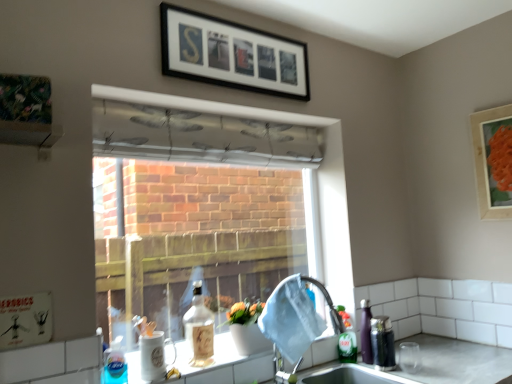
Describe the element at coordinates (155, 356) in the screenshot. I see `white ceramic mug at lower center, the 2th beverage from the right` at that location.

The width and height of the screenshot is (512, 384). What do you see at coordinates (115, 364) in the screenshot? I see `translucent plastic bottle at lower left, acting as the first bottle starting from the left` at bounding box center [115, 364].

Find the location of a particular element. The width and height of the screenshot is (512, 384). translucent plastic bottle at lower left, acting as the first bottle starting from the left is located at coordinates (115, 364).

Find the location of a particular element. black matte picture frame at upper center, which ranks as the first picture frame in left-to-right order is located at coordinates (231, 54).

Find the location of a particular element. The width and height of the screenshot is (512, 384). white ceramic mug at lower center, which is the 1th beverage in front-to-back order is located at coordinates (155, 356).

Relative to white ceramic mug at lower center, the first beverage in the left-to-right sequence, is translucent plastic bottle at lower right, the first beverage when ordered from back to front, in front or behind?

In the image, translucent plastic bottle at lower right, the first beverage when ordered from back to front, appears behind white ceramic mug at lower center, the first beverage in the left-to-right sequence.

Is translucent plastic bottle at lower right, placed as the first beverage when sorted from right to left, oriented away from white ceramic mug at lower center, the 2th beverage from the right?

No, translucent plastic bottle at lower right, placed as the first beverage when sorted from right to left, is not facing away from white ceramic mug at lower center, the 2th beverage from the right.

From a real-world perspective, is translucent plastic bottle at lower right, marked as the 2th beverage in a left-to-right arrangement, beneath white ceramic mug at lower center, the first beverage in the left-to-right sequence?

Yes, from a real-world perspective, translucent plastic bottle at lower right, marked as the 2th beverage in a left-to-right arrangement, is below white ceramic mug at lower center, the first beverage in the left-to-right sequence.

Which is in front, point (373, 347) or point (160, 355)?

The point (160, 355) is in front.

Is transparent fabric at center beside white ceramic mug at lower center?

No, transparent fabric at center is not making contact with white ceramic mug at lower center.

Could you tell me if transparent fabric at center is facing white ceramic mug at lower center?

Yes, transparent fabric at center is turned towards white ceramic mug at lower center.

Where is `counter top in front of the transparent fabric at center`? The height and width of the screenshot is (384, 512). counter top in front of the transparent fabric at center is located at coordinates (458, 361).

Is transparent fabric at center to the left of white ceramic mug at lower center from the viewer's perspective?

Yes.

Can you confirm if transparent fabric at center is bigger than black matte picture frame at upper center, which ranks as the first picture frame in left-to-right order?

Yes, transparent fabric at center is bigger than black matte picture frame at upper center, which ranks as the first picture frame in left-to-right order.

From the image's perspective, between transparent fabric at center and black matte picture frame at upper center, positioned as the 1th picture frame in top-to-bottom order, who is located below?

From the image's view, transparent fabric at center is below.

Which is behind, point (331, 245) or point (221, 21)?

Positioned behind is point (331, 245).

Which of these two, transparent fabric at center or black matte picture frame at upper center, positioned as the 1th picture frame in top-to-bottom order, is thinner?

With smaller width is black matte picture frame at upper center, positioned as the 1th picture frame in top-to-bottom order.

Based on the photo, who is more distant, translucent plastic bottle at lower left, the third bottle in the back-to-front sequence, or satin nickel faucet at sink right?

Positioned behind is satin nickel faucet at sink right.

Between translucent plastic bottle at lower left, placed as the first bottle when sorted from front to back, and satin nickel faucet at sink right, which one appears on the right side from the viewer's perspective?

satin nickel faucet at sink right.

Between translucent plastic bottle at lower left, which ranks as the third bottle in right-to-left order, and satin nickel faucet at sink right, which one has less height?

translucent plastic bottle at lower left, which ranks as the third bottle in right-to-left order.

Image resolution: width=512 pixels, height=384 pixels. I want to click on faucet on the right side of translucent plastic bottle at lower left, the third bottle in the back-to-front sequence, so click(x=294, y=322).

Which of these two, translucent glass bottle at lower center, the second bottle in the front-to-back sequence, or matte wooden picture frame at upper right, which is counted as the first picture frame, starting from the bottom, stands taller?

Standing taller between the two is matte wooden picture frame at upper right, which is counted as the first picture frame, starting from the bottom.

The image size is (512, 384). Identify the location of the 1st bottle located beneath the matte wooden picture frame at upper right, marked as the 1th picture frame in a right-to-left arrangement (from a real-world perspective). (199, 329).

From a real-world perspective, between translucent glass bottle at lower center, which ranks as the second bottle in left-to-right order, and matte wooden picture frame at upper right, which is counted as the second picture frame, starting from the left, who is vertically higher?

matte wooden picture frame at upper right, which is counted as the second picture frame, starting from the left, is physically above.

Between green matte bottle at sink right, the third bottle positioned from the left, and white ceramic mug at lower center, the first beverage in the left-to-right sequence, which one appears on the left side from the viewer's perspective?

white ceramic mug at lower center, the first beverage in the left-to-right sequence.

Considering the sizes of objects green matte bottle at sink right, placed as the first bottle when sorted from back to front, and white ceramic mug at lower center, which ranks as the 2th beverage in back-to-front order, in the image provided, who is wider, green matte bottle at sink right, placed as the first bottle when sorted from back to front, or white ceramic mug at lower center, which ranks as the 2th beverage in back-to-front order,?

With larger width is white ceramic mug at lower center, which ranks as the 2th beverage in back-to-front order.

Identify the location of the 2nd bottle positioned below the white ceramic mug at lower center, which ranks as the 2th beverage in back-to-front order (from the image's perspective). Image resolution: width=512 pixels, height=384 pixels. [346, 339].

Considering the sizes of green matte bottle at sink right, placed as the first bottle when sorted from back to front, and white ceramic mug at lower center, the first beverage in the left-to-right sequence, in the image, is green matte bottle at sink right, placed as the first bottle when sorted from back to front, bigger or smaller than white ceramic mug at lower center, the first beverage in the left-to-right sequence,?

Clearly, green matte bottle at sink right, placed as the first bottle when sorted from back to front, is smaller in size than white ceramic mug at lower center, the first beverage in the left-to-right sequence.

From a real-world perspective, is satin nickel faucet at sink right on top of white ceramic mug at lower center?

Correct, in the physical world, satin nickel faucet at sink right is higher than white ceramic mug at lower center.

Based on the photo, is satin nickel faucet at sink right with white ceramic mug at lower center?

They are not placed beside each other.

Is satin nickel faucet at sink right positioned with its back to white ceramic mug at lower center?

satin nickel faucet at sink right is not turned away from white ceramic mug at lower center.

What's the angular difference between satin nickel faucet at sink right and white ceramic mug at lower center's facing directions?

45.6 degrees.

Find the location of `beverage on the left of translucent plastic bottle at lower right, the first beverage when ordered from back to front`. beverage on the left of translucent plastic bottle at lower right, the first beverage when ordered from back to front is located at coordinates (155, 356).

Where is `window that appears above the white ceramic mug at lower center (from the image's perspective)`? This screenshot has height=384, width=512. window that appears above the white ceramic mug at lower center (from the image's perspective) is located at coordinates (304, 182).

Considering their positions, is matte wooden picture frame at upper right, which is counted as the second picture frame, starting from the left, positioned closer to white ceramic mug at lower center, which ranks as the 2th beverage in back-to-front order, than black matte picture frame at upper center, the 2th picture frame from the right?

Based on the image, black matte picture frame at upper center, the 2th picture frame from the right, appears to be nearer to white ceramic mug at lower center, which ranks as the 2th beverage in back-to-front order.

From the image, which object appears to be farther from translucent plastic bottle at lower right, marked as the 2th beverage in a left-to-right arrangement, white ceramic mug at lower center, the first beverage in the left-to-right sequence, or transparent fabric at center?

white ceramic mug at lower center, the first beverage in the left-to-right sequence, is positioned further to the anchor translucent plastic bottle at lower right, marked as the 2th beverage in a left-to-right arrangement.

Based on their spatial positions, is translucent plastic bottle at lower left, which ranks as the third bottle in right-to-left order, or matte wooden picture frame at upper right, acting as the 2th picture frame starting from the top, further from black matte picture frame at upper center, the 2th picture frame from the right?

translucent plastic bottle at lower left, which ranks as the third bottle in right-to-left order, lies further to black matte picture frame at upper center, the 2th picture frame from the right, than the other object.

Which object lies further to the anchor point black matte picture frame at upper center, the second picture frame in the bottom-to-top sequence, white ceramic mug at lower center or green matte bottle at sink right, the third bottle when ordered from front to back?

white ceramic mug at lower center lies further to black matte picture frame at upper center, the second picture frame in the bottom-to-top sequence, than the other object.

Which object lies further to the anchor point matte wooden picture frame at upper right, acting as the 2th picture frame starting from the top, black matte picture frame at upper center, positioned as the 1th picture frame in top-to-bottom order, or white ceramic mug at lower center?

black matte picture frame at upper center, positioned as the 1th picture frame in top-to-bottom order, lies further to matte wooden picture frame at upper right, acting as the 2th picture frame starting from the top, than the other object.

Based on their spatial positions, is white ceramic mug at lower center, the first beverage in the left-to-right sequence, or white ceramic mug at lower center further from black matte picture frame at upper center, positioned as the 1th picture frame in top-to-bottom order?

white ceramic mug at lower center lies further to black matte picture frame at upper center, positioned as the 1th picture frame in top-to-bottom order, than the other object.

When comparing their distances from black matte picture frame at upper center, the 2th picture frame from the right, does white ceramic mug at lower center, the 2th beverage from the right, or transparent fabric at center seem further?

white ceramic mug at lower center, the 2th beverage from the right, is positioned further to the anchor black matte picture frame at upper center, the 2th picture frame from the right.

Which object lies further to the anchor point translucent plastic bottle at lower right, marked as the second beverage in a front-to-back arrangement, satin nickel faucet at sink right or transparent fabric at center?

The object further to translucent plastic bottle at lower right, marked as the second beverage in a front-to-back arrangement, is transparent fabric at center.

Identify the location of counter top between translucent plastic bottle at lower left, placed as the first bottle when sorted from front to back, and translucent plastic bottle at lower right, marked as the second beverage in a front-to-back arrangement. The width and height of the screenshot is (512, 384). (458, 361).

The height and width of the screenshot is (384, 512). In order to click on picture frame between black matte picture frame at upper center, the 2th picture frame from the right, and translucent plastic bottle at lower right, marked as the second beverage in a front-to-back arrangement, in the vertical direction in this screenshot , I will do `click(493, 160)`.

Image resolution: width=512 pixels, height=384 pixels. I want to click on beverage between translucent plastic bottle at lower left, which ranks as the third bottle in right-to-left order, and white ceramic mug at lower center from left to right, so click(155, 356).

The image size is (512, 384). I want to click on picture frame situated between white ceramic mug at lower center, the 2th beverage from the right, and matte wooden picture frame at upper right, marked as the 1th picture frame in a right-to-left arrangement, from left to right, so click(231, 54).